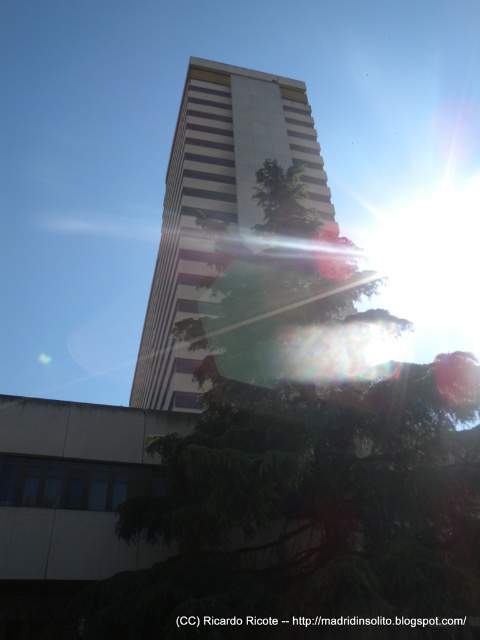
You are an architect designing a new park and want to place a bench between the green leafy tree at center and the white striped building at center. Based on their widths, which object should be closer to the bench to ensure there is enough space for people to walk comfortably?

The green leafy tree at center has a smaller width than the white striped building at center, so placing the bench closer to the green leafy tree at center would leave more space between the bench and the wider white striped building at center, allowing for comfortable walking space.

You are a drone operator who needs to fly a drone from the green leafy tree at center to the white striped building at center. What is the minimum distance the drone must travel to reach the building from the tree?

The minimum distance the drone must travel is 26.73 meters between the green leafy tree at center and the white striped building at center.

From the picture: You are standing in the park and see the green leafy tree at center and the white striped building at center. Which object is closer to the ground?

The green leafy tree at center is closer to the ground than the white striped building at center.